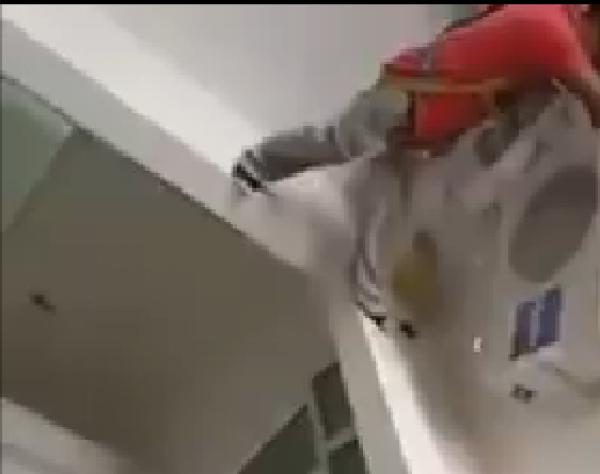
Locate an element on the screen. red padding is located at coordinates (527, 57).